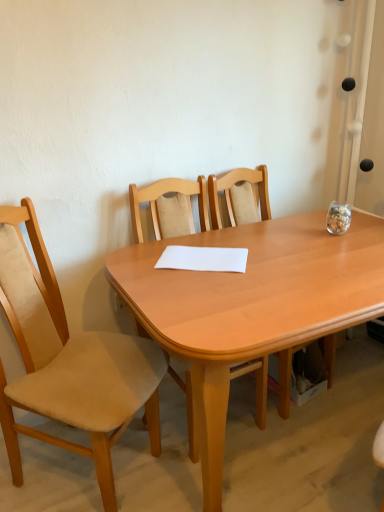
Where is `vacant space in front of wooden chair at center, the first chair in the right-to-left sequence`? vacant space in front of wooden chair at center, the first chair in the right-to-left sequence is located at coordinates (307, 448).